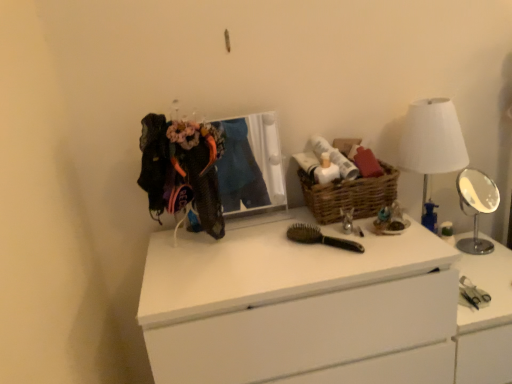
Locate an element on the screen. The image size is (512, 384). free space to the back side of black wooden hairbrush at center is located at coordinates (297, 222).